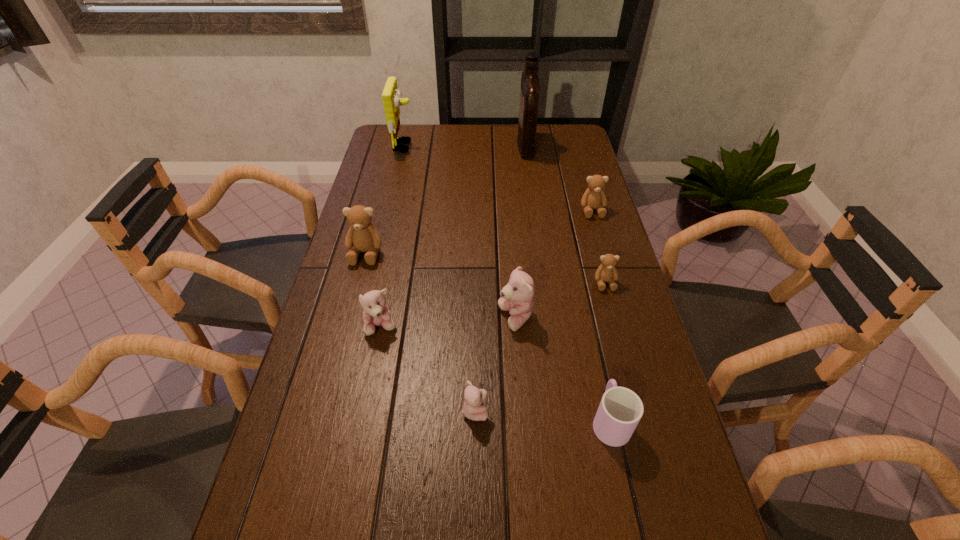
I want to click on liquor situated at the far edge, so [530, 86].

Image resolution: width=960 pixels, height=540 pixels. Identify the location of sponge situated at the far edge. (391, 96).

The width and height of the screenshot is (960, 540). In order to click on sponge at the left edge in this screenshot , I will do `click(391, 96)`.

Identify the location of cup that is positioned at the right edge. This screenshot has width=960, height=540. (620, 410).

Find the location of `object located at the far left corner`. object located at the far left corner is located at coordinates (391, 96).

This screenshot has width=960, height=540. In the image, there is a desktop. What are the coordinates of `blank space at the far edge` in the screenshot? It's located at (437, 149).

The image size is (960, 540). Find the location of `vacant space at the left edge of the desktop`. vacant space at the left edge of the desktop is located at coordinates [402, 217].

Where is `vacant space at the right edge of the desktop`? This screenshot has height=540, width=960. vacant space at the right edge of the desktop is located at coordinates (663, 397).

This screenshot has width=960, height=540. Identify the location of free space at the far left corner of the desktop. (409, 148).

At what (x,y) coordinates should I click in order to perform the action: click on blank region between the cup and the smallest pink teddy bear. Please return your answer as a coordinate pair (x, y). The height and width of the screenshot is (540, 960). Looking at the image, I should click on (542, 415).